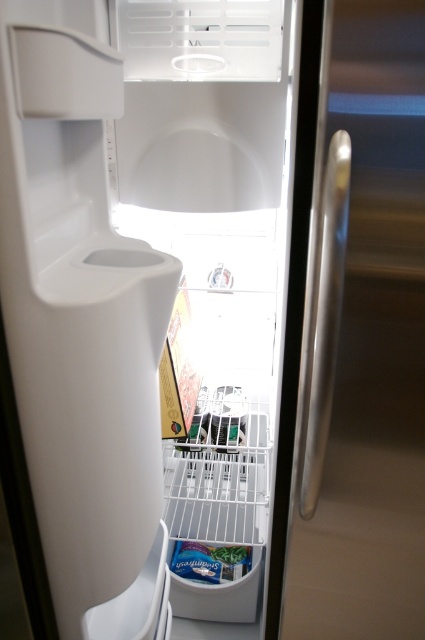
Question: Does satin silver handle at center right appear under green matte vegetable at lower center?

Choices:
 (A) yes
 (B) no

Answer: (B)

Question: In this image, where is satin silver handle at center right located relative to green matte vegetable at lower center?

Choices:
 (A) below
 (B) above

Answer: (B)

Question: Among these points, which one is farthest from the camera?

Choices:
 (A) (346, 388)
 (B) (175, 547)

Answer: (B)

Question: Among these objects, which one is nearest to the camera?

Choices:
 (A) satin silver handle at center right
 (B) green matte vegetable at lower center

Answer: (A)

Question: Does satin silver handle at center right have a larger size compared to green matte vegetable at lower center?

Choices:
 (A) no
 (B) yes

Answer: (B)

Question: Among these objects, which one is farthest from the camera?

Choices:
 (A) satin silver handle at center right
 (B) green matte vegetable at lower center

Answer: (B)